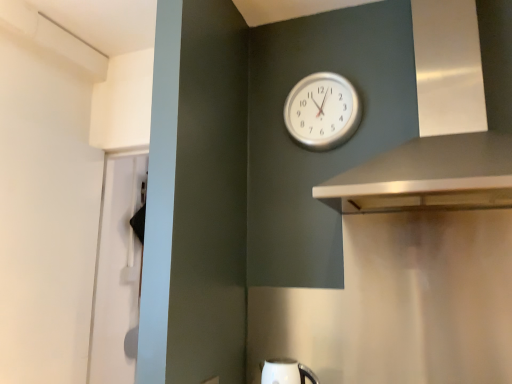
Question: Should I look upward or downward to see silver metallic clock at upper center?

Choices:
 (A) up
 (B) down

Answer: (A)

Question: Is silver metallic clock at upper center aimed at silver metallic vent at upper right?

Choices:
 (A) yes
 (B) no

Answer: (B)

Question: Is silver metallic clock at upper center thinner than silver metallic vent at upper right?

Choices:
 (A) no
 (B) yes

Answer: (B)

Question: From the image's perspective, is silver metallic clock at upper center below silver metallic vent at upper right?

Choices:
 (A) no
 (B) yes

Answer: (B)

Question: Considering the relative sizes of silver metallic clock at upper center and silver metallic vent at upper right in the image provided, is silver metallic clock at upper center smaller than silver metallic vent at upper right?

Choices:
 (A) no
 (B) yes

Answer: (B)

Question: Is silver metallic clock at upper center taller than silver metallic vent at upper right?

Choices:
 (A) no
 (B) yes

Answer: (A)

Question: Does silver metallic clock at upper center lie behind silver metallic vent at upper right?

Choices:
 (A) yes
 (B) no

Answer: (A)

Question: Is white glossy kettle at lower center shorter than silver metallic vent at upper right?

Choices:
 (A) yes
 (B) no

Answer: (A)

Question: Is white glossy kettle at lower center bigger than silver metallic vent at upper right?

Choices:
 (A) yes
 (B) no

Answer: (B)

Question: From the image's perspective, is white glossy kettle at lower center beneath silver metallic vent at upper right?

Choices:
 (A) no
 (B) yes

Answer: (B)

Question: Is white glossy kettle at lower center thinner than silver metallic vent at upper right?

Choices:
 (A) yes
 (B) no

Answer: (A)

Question: Can you confirm if white glossy kettle at lower center is positioned to the left of silver metallic vent at upper right?

Choices:
 (A) yes
 (B) no

Answer: (A)

Question: From a real-world perspective, is white glossy kettle at lower center located higher than silver metallic vent at upper right?

Choices:
 (A) no
 (B) yes

Answer: (A)

Question: Does silver metallic vent at upper right have a lesser width compared to white glossy kettle at lower center?

Choices:
 (A) no
 (B) yes

Answer: (A)